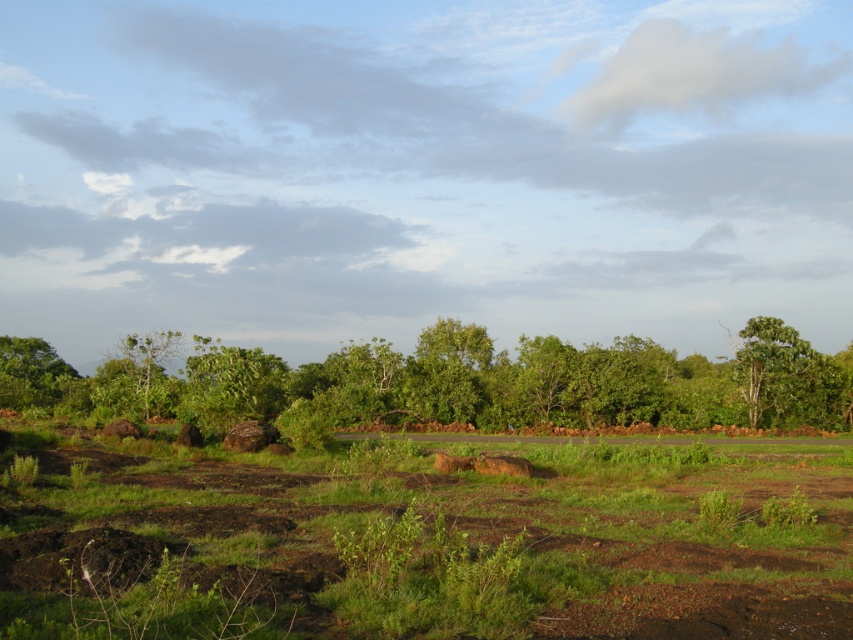
Between green leafy tree at center and green leafy tree at left, which one is positioned lower?

green leafy tree at center

Is point (564, 397) farther from camera compared to point (44, 358)?

No.

What are the coordinates of `green leafy tree at center` in the screenshot? It's located at (451, 381).